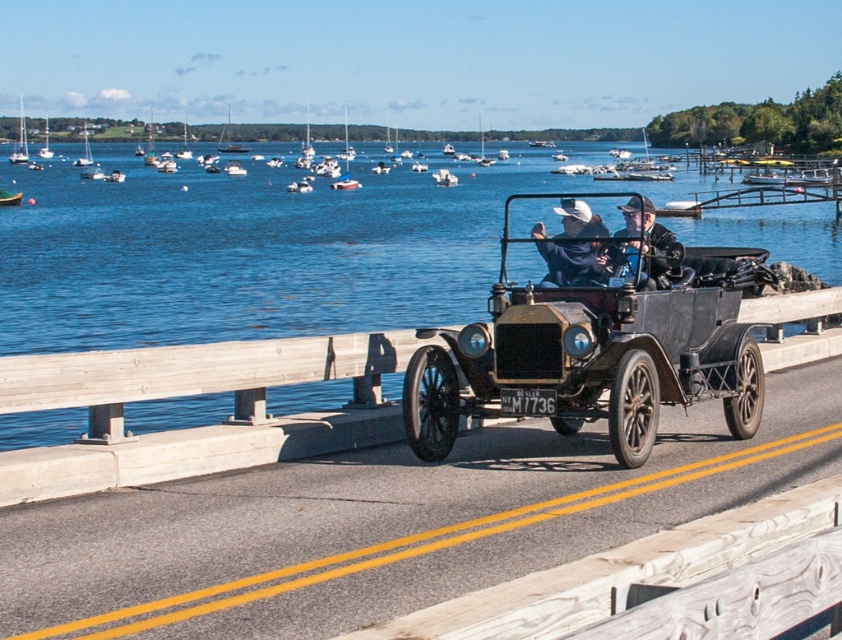
Question: Which point is closer to the camera?

Choices:
 (A) green fabric boat at left
 (B) white sailboat at center
 (C) dark blue leather jacket at center

Answer: (C)

Question: Can you confirm if white leather cap at center is wider than green fabric boat at left?

Choices:
 (A) no
 (B) yes

Answer: (A)

Question: Where is white leather cap at center located in relation to green fabric boat at left in the image?

Choices:
 (A) right
 (B) left

Answer: (A)

Question: Estimate the real-world distances between objects in this image. Which object is closer to the green fabric boat at left?

Choices:
 (A) dark blue leather jacket at center
 (B) blue water at center
 (C) white leather cap at center

Answer: (B)

Question: Does blue water at center appear on the left side of shiny black car at center?

Choices:
 (A) yes
 (B) no

Answer: (A)

Question: Which of the following is the farthest from the observer?

Choices:
 (A) coord(297,211)
 (B) coord(571,285)

Answer: (A)